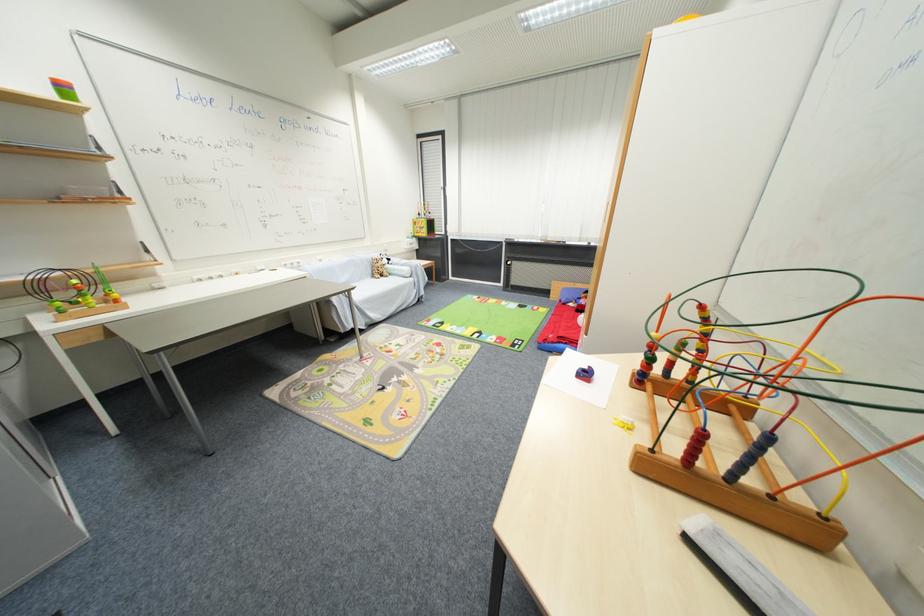
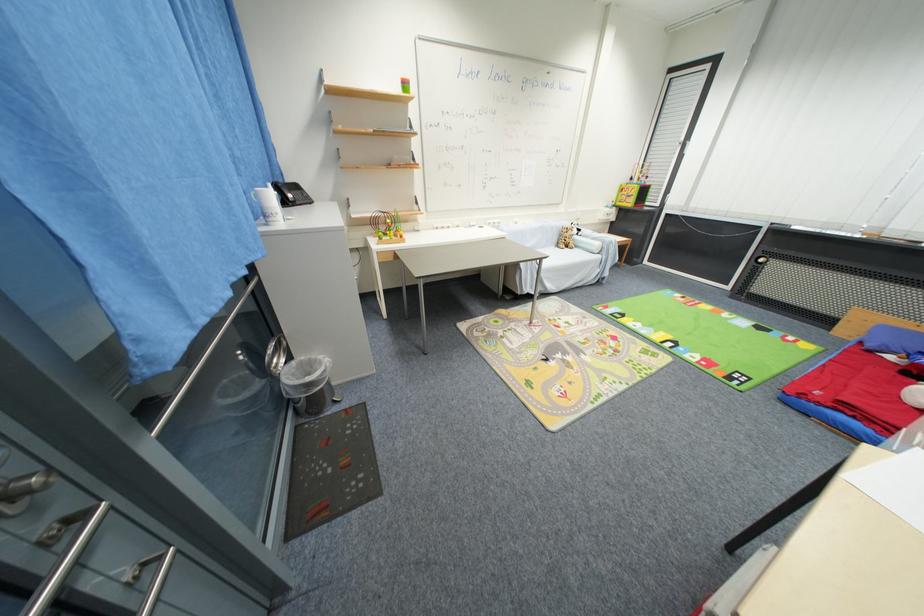
Find the pixel in the second image that matches (558,344) in the first image.

(824, 406)